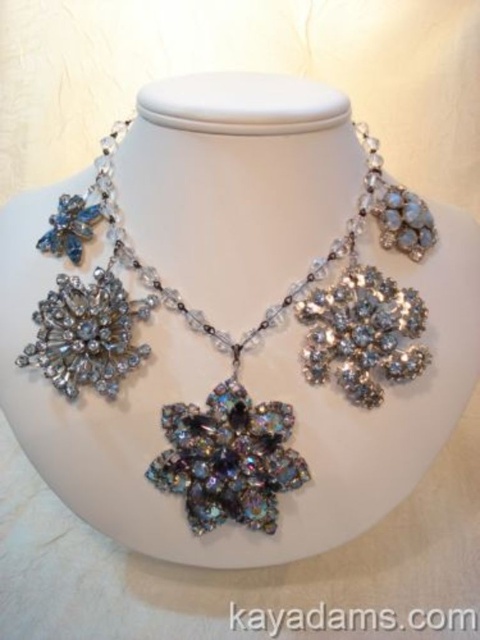
Question: Which point is farther from the camera taking this photo?

Choices:
 (A) (375, 384)
 (B) (101, 289)
 (C) (212, 400)

Answer: (B)

Question: Can you confirm if iridescent crystal necklace at center is positioned below iridescent crystal flower at center?

Choices:
 (A) no
 (B) yes

Answer: (A)

Question: Does iridescent crystal flower at center have a smaller size compared to iridescent crystal flower at lower left?

Choices:
 (A) yes
 (B) no

Answer: (B)

Question: Which object appears closest to the camera in this image?

Choices:
 (A) iridescent crystal flower at lower left
 (B) iridescent crystal flower at center

Answer: (A)

Question: Which object is positioned closest to the iridescent crystal flower at center?

Choices:
 (A) iridescent crystal necklace at center
 (B) iridescent crystal flower at lower left

Answer: (A)

Question: Is iridescent crystal necklace at center to the left of iridescent crystal flower at lower left from the viewer's perspective?

Choices:
 (A) no
 (B) yes

Answer: (A)